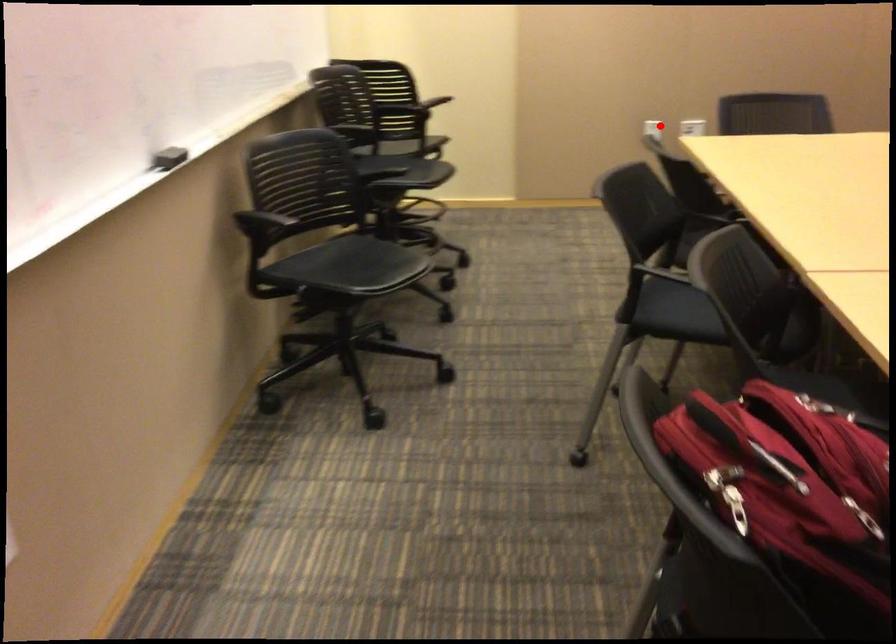
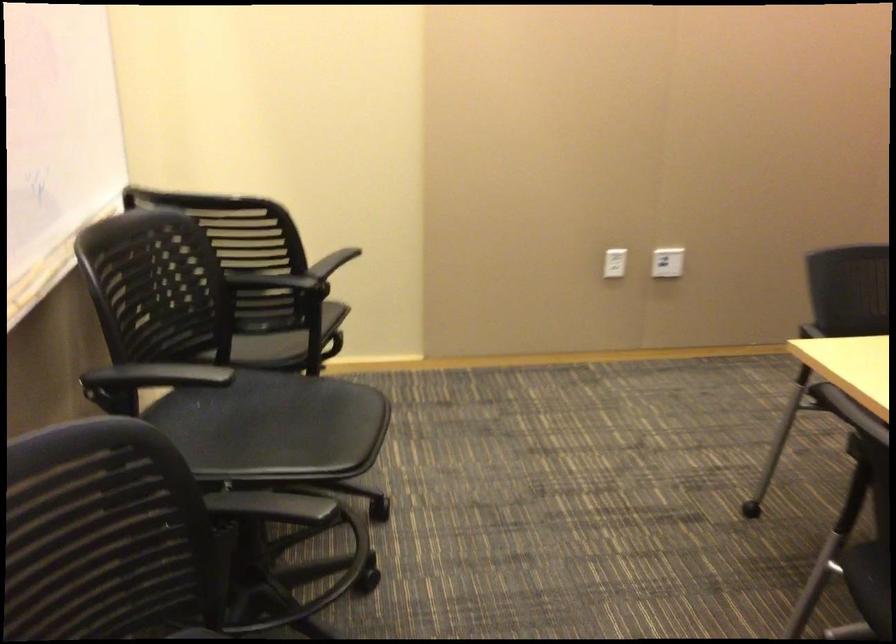
Question: A red point is marked in image1. In image2, is the corresponding 3D point closer to the camera or farther? Reply with the corresponding letter.

Choices:
 (A) The corresponding 3D point is closer.
 (B) The corresponding 3D point is farther.

Answer: (A)